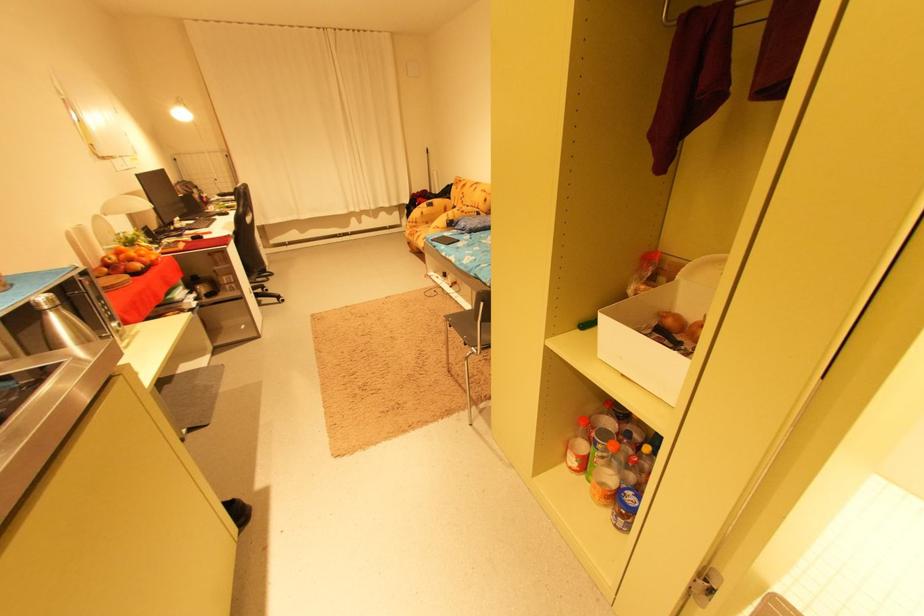
The height and width of the screenshot is (616, 924). What do you see at coordinates (247, 233) in the screenshot?
I see `the office chair seat` at bounding box center [247, 233].